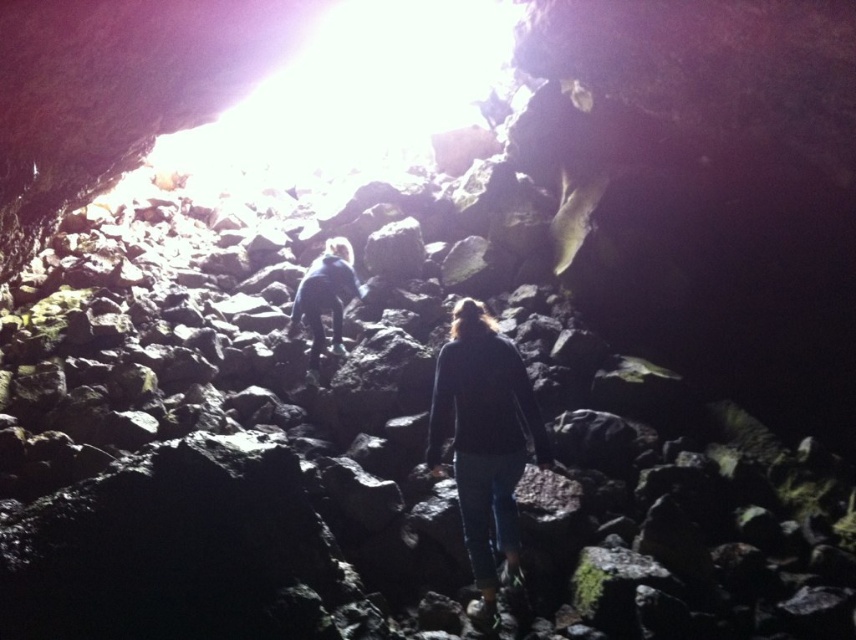
Is the position of dark blue sweater at center more distant than that of dark blue shirt at center?

No.

Who is positioned more to the right, dark blue sweater at center or dark blue shirt at center?

Positioned to the right is dark blue sweater at center.

Does point (520, 406) come farther from viewer compared to point (337, 307)?

No, (520, 406) is closer to viewer.

The image size is (856, 640). What are the coordinates of `dark blue sweater at center` in the screenshot? It's located at (485, 442).